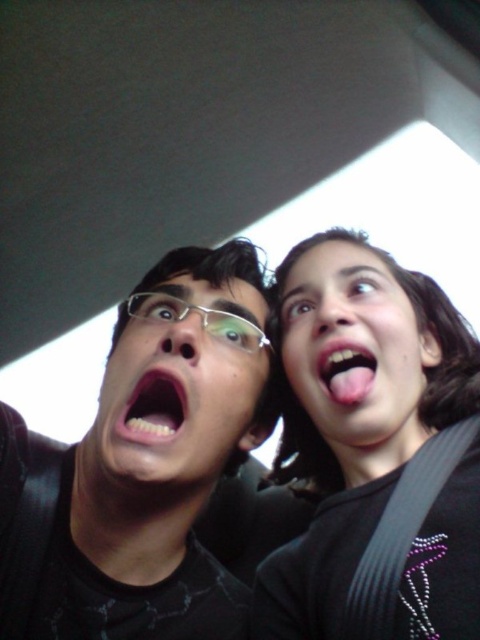
Question: Can you confirm if black matte glasses at upper left is positioned above smooth skin face at upper right?

Choices:
 (A) yes
 (B) no

Answer: (B)

Question: Observing the image, what is the correct spatial positioning of matte black face at center in reference to pink glossy tongue at upper right?

Choices:
 (A) above
 (B) below

Answer: (B)

Question: Which of the following is the closest to the observer?

Choices:
 (A) (158, 372)
 (B) (397, 413)

Answer: (A)

Question: Considering the real-world distances, which object is farthest from the matte black face at center?

Choices:
 (A) pink glossy tongue at upper right
 (B) black matte glasses at upper left
 (C) smooth skin face at upper right
 (D) black fabric at upper right

Answer: (A)

Question: Which of the following is the closest to the observer?

Choices:
 (A) black fabric at upper right
 (B) pink glossy teeth at center
 (C) smooth skin face at upper right

Answer: (A)

Question: Does black matte glasses at upper left have a smaller size compared to black fabric at upper right?

Choices:
 (A) yes
 (B) no

Answer: (A)